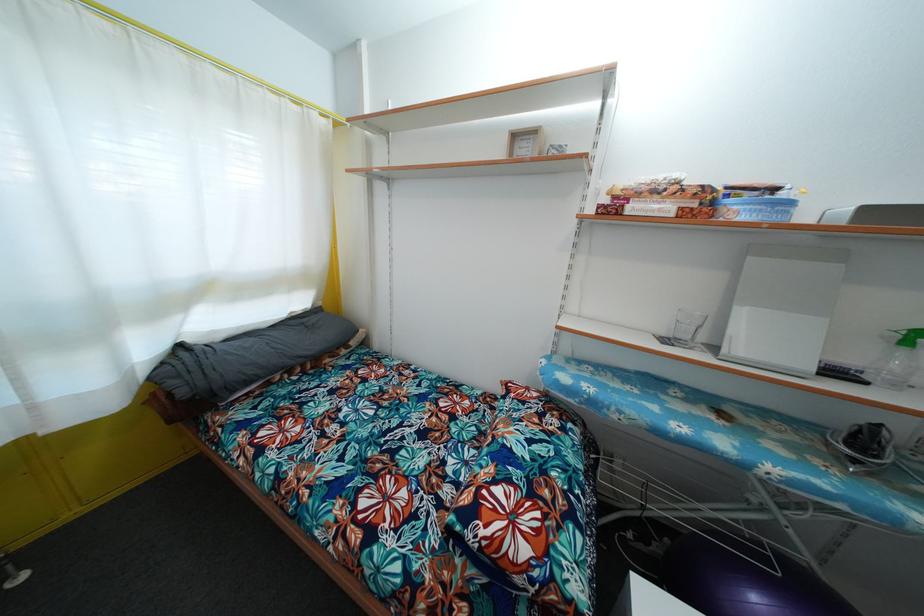
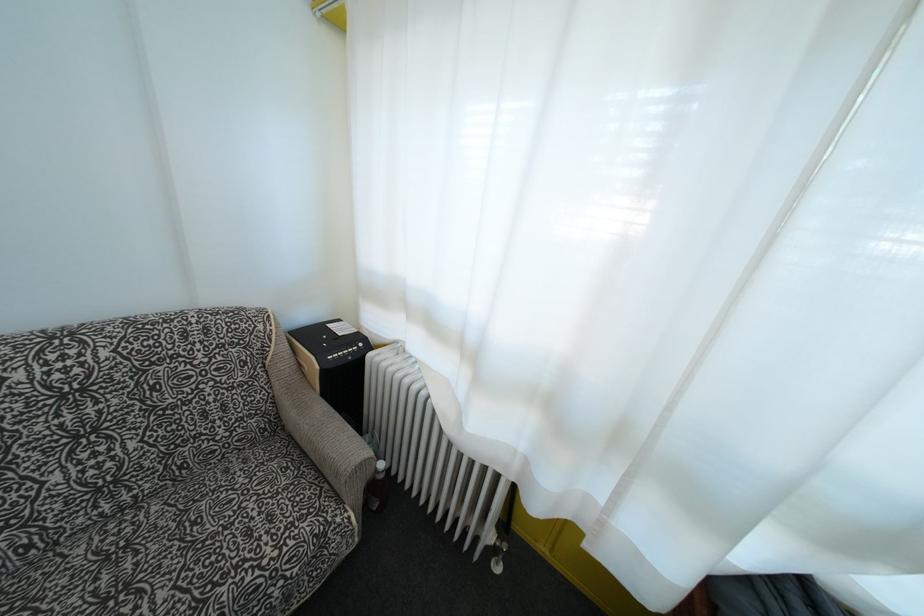
Based on the continuous images, in which direction is the camera rotating?

The camera rotated toward left-down.